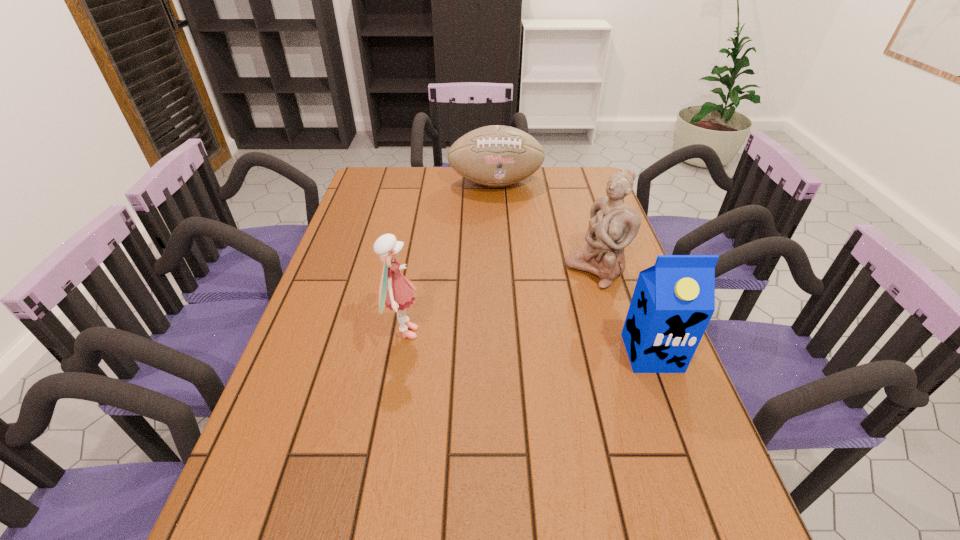
What are the coordinates of `free spot at the near left corner of the desktop` in the screenshot? It's located at (296, 488).

The image size is (960, 540). I want to click on free spot at the far right corner of the desktop, so click(593, 170).

At what (x,y) coordinates should I click in order to perform the action: click on free space between the second farthest object and the third object from right to left. Please return your answer as a coordinate pair (x, y). The height and width of the screenshot is (540, 960). Looking at the image, I should click on (545, 227).

Locate an element on the screen. The image size is (960, 540). blank region between the doll and the farthest object is located at coordinates (449, 258).

The image size is (960, 540). Identify the location of free spot between the figurine and the farthest object. (545, 227).

Identify the location of free space between the second farthest object and the third object from right to left. (545, 227).

Find the location of `free area in between the third object from right to left and the leftmost object`. free area in between the third object from right to left and the leftmost object is located at coordinates (449, 258).

Find the location of a particular element. vacant region between the leftmost object and the carton is located at coordinates (528, 343).

Locate an element on the screen. This screenshot has width=960, height=540. free point between the leftmost object and the figurine is located at coordinates 500,302.

This screenshot has width=960, height=540. In order to click on free space between the second object from left to right and the carton in this screenshot , I will do [574, 268].